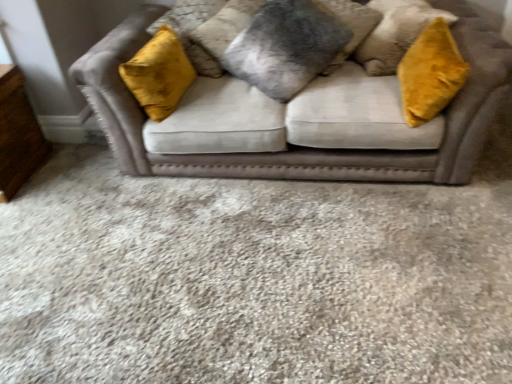
Find the location of a particular element. The height and width of the screenshot is (384, 512). free spot in front of velvet beige couch at center is located at coordinates (249, 257).